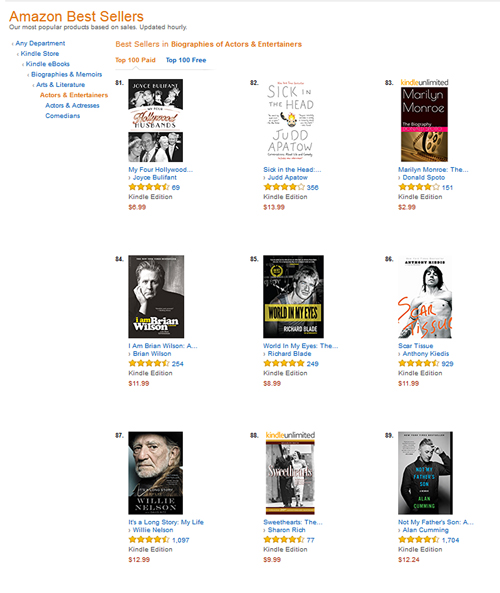
The image size is (500, 593). I want to click on books, so click(x=430, y=492), click(x=306, y=494), click(x=160, y=479), click(x=151, y=295), click(x=291, y=312), click(x=424, y=302), click(x=427, y=138), click(x=275, y=123), click(x=140, y=123).